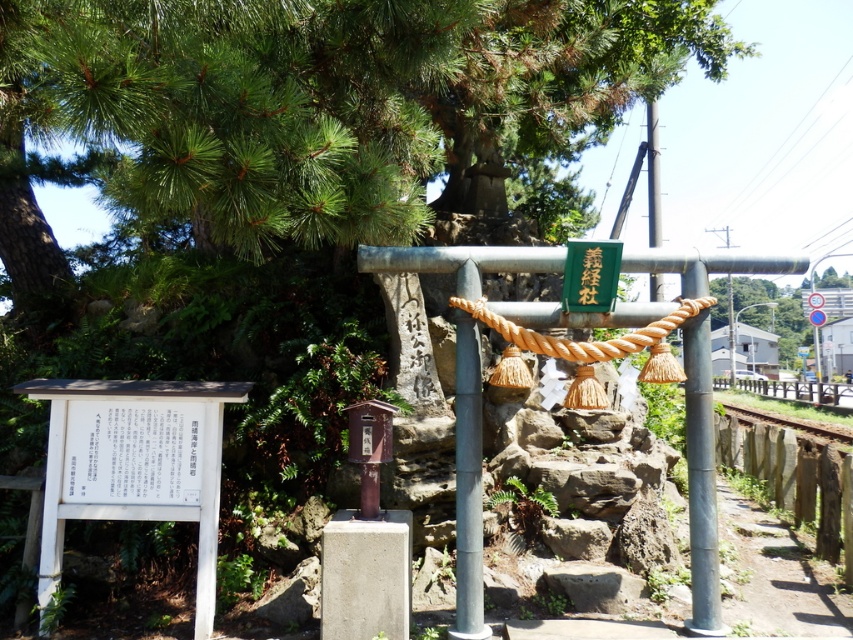
Who is more forward, (689, 502) or (567, 349)?

Point (567, 349) is more forward.

In the scene shown: Is metallic gray pole at right smaller than roperough at center?

Yes, metallic gray pole at right is smaller than roperough at center.

Which is behind, point (706, 516) or point (674, 317)?

Positioned behind is point (706, 516).

Locate an element on the screen. This screenshot has height=640, width=853. metallic gray pole at right is located at coordinates (701, 481).

How much distance is there between metallic gray pole at right and gray concrete train track at lower right?

metallic gray pole at right is 32.35 feet away from gray concrete train track at lower right.

Looking at this image, is metallic gray pole at right to the right of gray concrete train track at lower right from the viewer's perspective?

No, metallic gray pole at right is not to the right of gray concrete train track at lower right.

Which is behind, point (680, 282) or point (776, 420)?

Point (776, 420)

The width and height of the screenshot is (853, 640). In order to click on metallic gray pole at right in this screenshot , I will do `click(701, 481)`.

Does green leafy tree at right appear over roperough at center?

Correct, green leafy tree at right is located above roperough at center.

Between green leafy tree at right and roperough at center, which one has more height?

Standing taller between the two is green leafy tree at right.

Who is more forward, (791,326) or (593,356)?

Positioned in front is point (593,356).

Locate an element on the screen. Image resolution: width=853 pixels, height=640 pixels. green leafy tree at right is located at coordinates (773, 314).